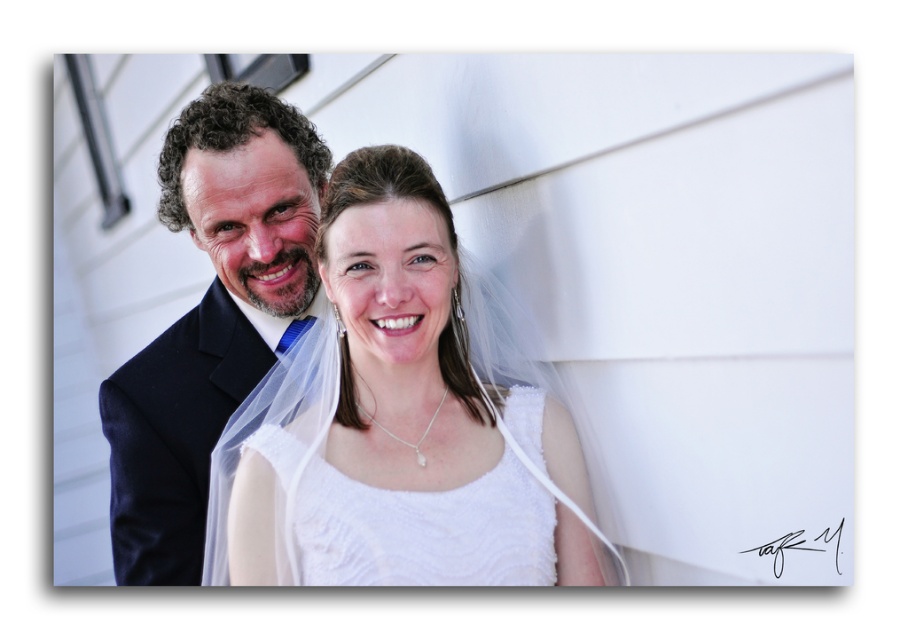
Question: Estimate the real-world distances between objects in this image. Which object is farther from the white lace dress at center?

Choices:
 (A) white textured fabric at center
 (B) dark blue suit at left

Answer: (B)

Question: Among these points, which one is nearest to the camera?

Choices:
 (A) (475, 582)
 (B) (166, 339)

Answer: (A)

Question: Can you confirm if dark blue suit at left is wider than white textured fabric at center?

Choices:
 (A) yes
 (B) no

Answer: (B)

Question: Is white lace dress at center bigger than white textured fabric at center?

Choices:
 (A) no
 (B) yes

Answer: (B)

Question: Which point appears farthest from the camera in this image?

Choices:
 (A) (295, 497)
 (B) (141, 500)

Answer: (B)

Question: Is white lace dress at center smaller than dark blue suit at left?

Choices:
 (A) yes
 (B) no

Answer: (B)